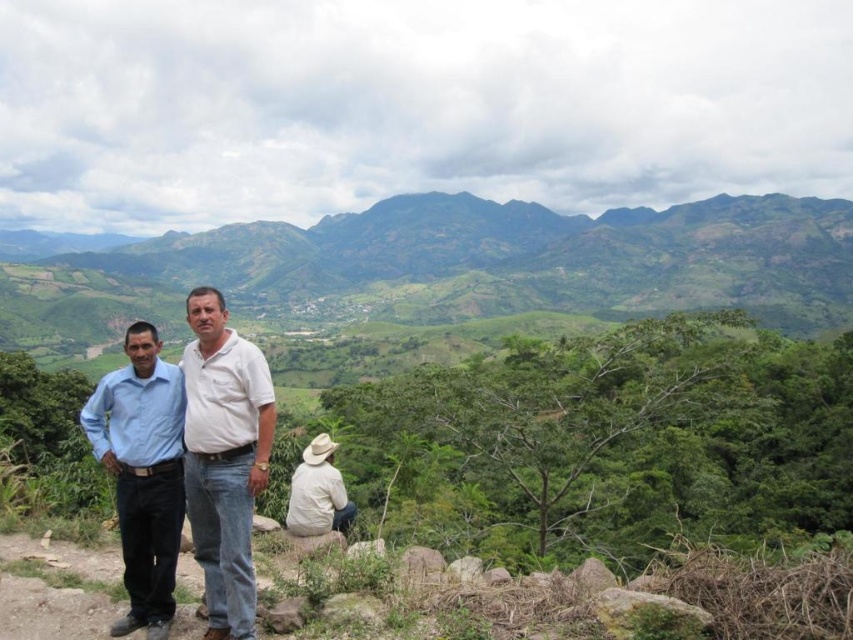
You are standing in the scenic outdoor setting and want to place a small flag at the point closer to you between the two points labeled point (309, 244) and point (308, 525). Which point should you choose?

You should choose point (309, 244) because it is closer to you than point (308, 525).

You are a photographer planning to take a group photo of the matte blue shirt at center and the other people in the scene. Based on their positions, which person should you position closer to the camera to ensure they are in focus?

The matte blue shirt at center is positioned closer to the camera since it is at point (224,458), which is closer to the camera compared to the other individuals in the scene.